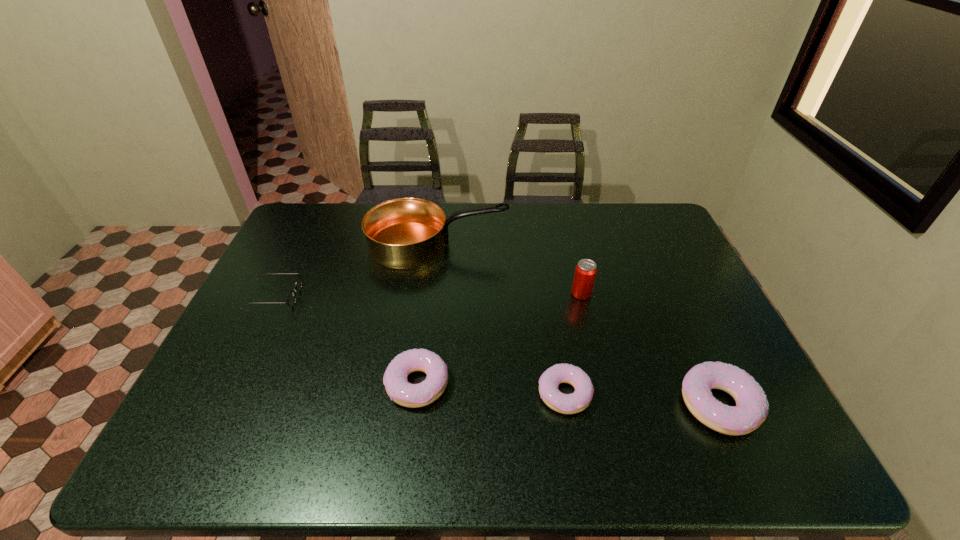
Image resolution: width=960 pixels, height=540 pixels. What are the coordinates of `vacant area at the far edge of the desktop` in the screenshot? It's located at (586, 207).

Identify the location of vacant space at the near edge of the desktop. (544, 408).

I want to click on vacant area at the left edge, so click(x=237, y=357).

Identify the location of vacant space at the right edge. The image size is (960, 540). (732, 345).

At what (x,y) coordinates should I click in order to perform the action: click on vacant space at the far left corner. Please return your answer as a coordinate pair (x, y). This screenshot has width=960, height=540. Looking at the image, I should click on (x=335, y=228).

In the image, there is a desktop. Identify the location of free space at the far right corner. point(625,210).

Image resolution: width=960 pixels, height=540 pixels. What are the coordinates of `unoccupied area between the fifth object from left to right and the fourth tallest object` in the screenshot? It's located at (499, 339).

At what (x,y) coordinates should I click in order to perform the action: click on vacant point located between the leftmost doughnut and the second tallest object. Please return your answer as a coordinate pair (x, y). This screenshot has width=960, height=540. Looking at the image, I should click on (499, 339).

This screenshot has height=540, width=960. I want to click on free space between the fifth shortest object and the second doughnut from right to left, so coord(573,344).

The height and width of the screenshot is (540, 960). Find the location of `vacant area that lies between the third object from right to left and the rightmost doughnut`. vacant area that lies between the third object from right to left and the rightmost doughnut is located at coordinates (642, 400).